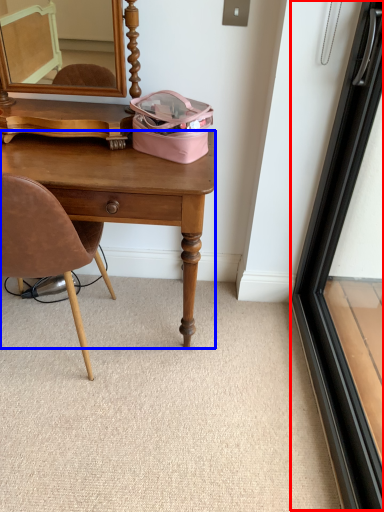
Question: Which object is closer to the camera taking this photo, screen door (highlighted by a red box) or desk (highlighted by a blue box)?

Choices:
 (A) screen door
 (B) desk

Answer: (A)